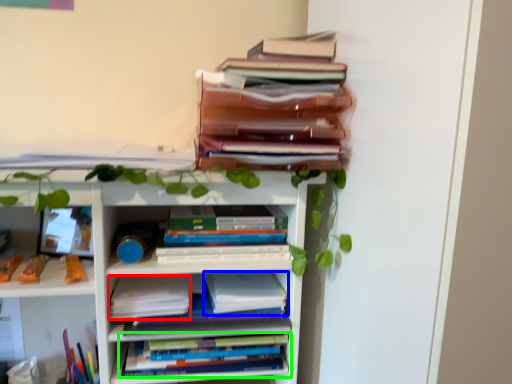
Question: Considering the real-world distances, which object is closest to paperback book (highlighted by a red box)? paperback book (highlighted by a blue box) or book (highlighted by a green box).

Choices:
 (A) paperback book
 (B) book

Answer: (A)